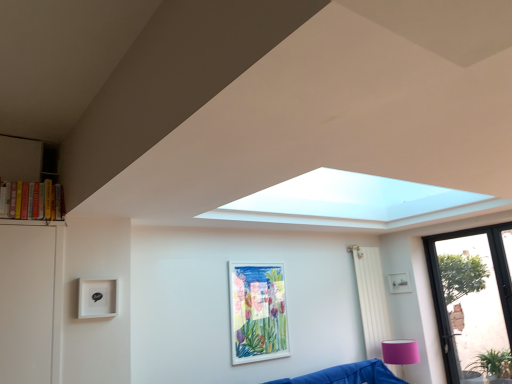
Identify the location of free space above white matte picture frame at center, which is counted as the 1th picture frame, starting from the left (from a real-world perspective). This screenshot has width=512, height=384. (252, 261).